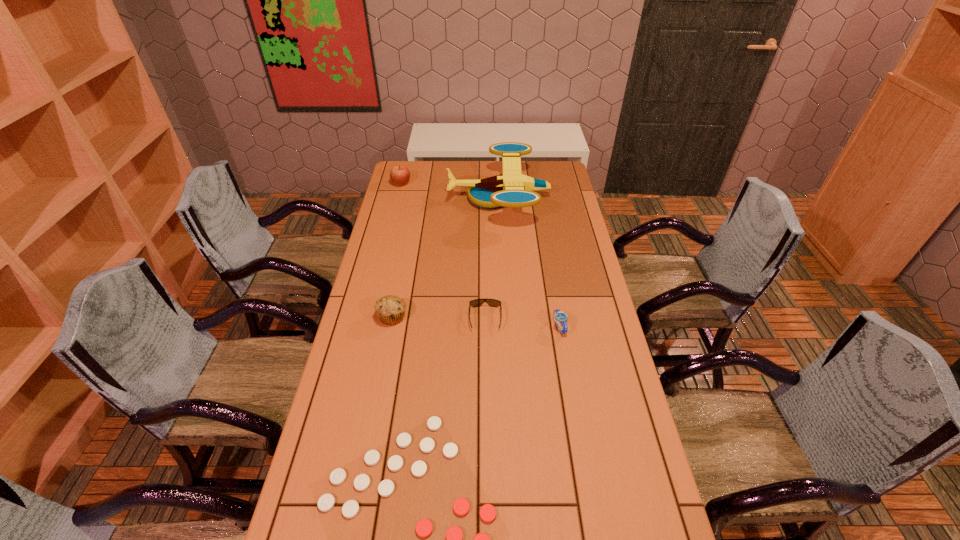
Find the location of a particular element. The height and width of the screenshot is (540, 960). vacant space at the far edge of the desktop is located at coordinates coord(466,172).

This screenshot has width=960, height=540. What are the coordinates of `free space at the left edge of the desktop` in the screenshot? It's located at (374, 281).

I want to click on vacant area at the right edge, so click(x=551, y=206).

This screenshot has height=540, width=960. What are the coordinates of `empty location between the apple and the fourth shortest object` in the screenshot? It's located at (396, 250).

Locate an element on the screen. The width and height of the screenshot is (960, 540). empty space between the third shortest object and the second shortest object is located at coordinates (522, 323).

Locate an element on the screen. The height and width of the screenshot is (540, 960). empty space between the sunglasses and the tallest object is located at coordinates (492, 259).

Identify the location of unoccupied area between the fourth tallest object and the sunglasses. The width and height of the screenshot is (960, 540). (522, 323).

The height and width of the screenshot is (540, 960). I want to click on vacant area between the watch and the fourth shortest object, so click(475, 322).

Locate an element on the screen. The height and width of the screenshot is (540, 960). free spot between the drone and the third shortest object is located at coordinates (529, 263).

The height and width of the screenshot is (540, 960). Identify the location of vacant space that is in between the fifth tallest object and the muffin. (439, 318).